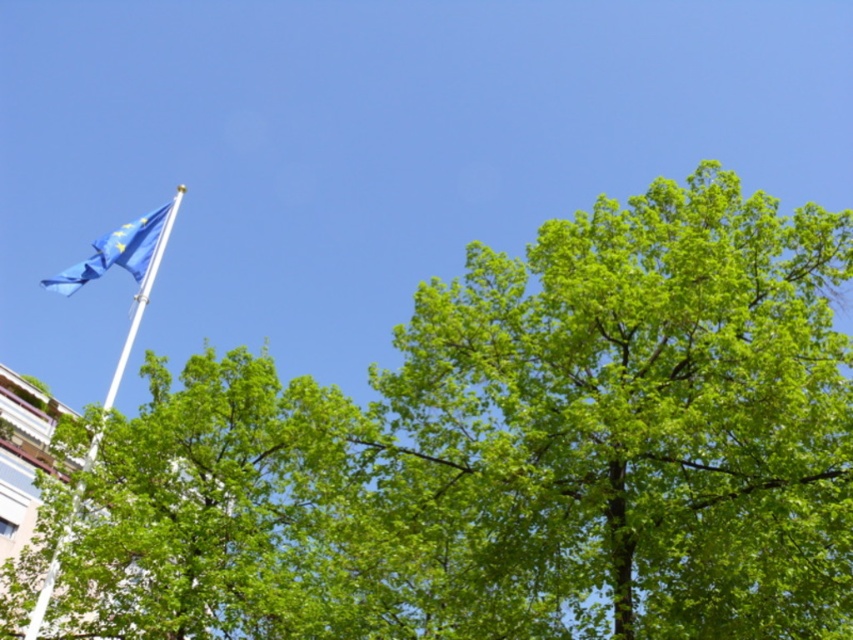
You are planning to hang a banner between the green leafy tree at center and the white metallic flag pole at upper left. Which object has a narrower width to ensure the banner can be securely attached?

The green leafy tree at center is thinner than the white metallic flag pole at upper left, so the banner should be securely attached to the green leafy tree at center since it has a narrower width.

You are a photographer planning to take a picture of the white metallic flag pole at upper left and the blue fabric flag at upper left. You want to ensure both are clearly visible in the frame. Given that the flag pole is larger than the flag, which object should you focus on to ensure both are in focus?

Since the white metallic flag pole at upper left is larger than the blue fabric flag at upper left, you should focus on the white metallic flag pole at upper left to ensure both are in focus as it occupies more space in the frame.